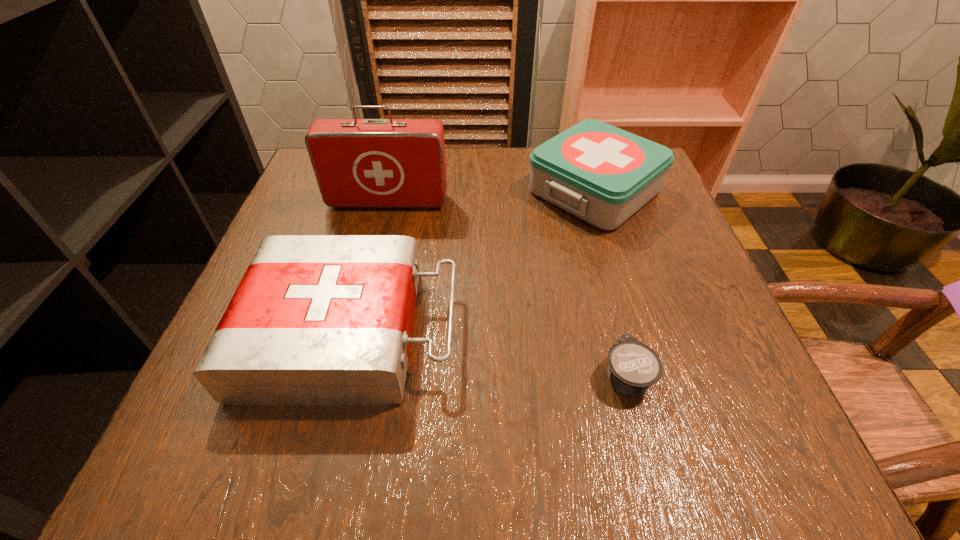
Identify the location of free space between the rightmost first-aid kit and the tallest first-aid kit. Image resolution: width=960 pixels, height=540 pixels. (492, 197).

What are the coordinates of `empty location between the shortest object and the nearest first-aid kit` in the screenshot? It's located at (489, 353).

You are a GUI agent. You are given a task and a screenshot of the screen. Output one action in this format:
    pyautogui.click(x=<x>, y=<y>)
    Task: Click on the free space between the nearest first-aid kit and the rightmost first-aid kit
    Image resolution: width=960 pixels, height=540 pixels.
    Given the screenshot: What is the action you would take?
    pyautogui.click(x=473, y=261)

Identify the location of object that is the closest to the rightmost first-aid kit. (359, 163).

Locate an element on the screen. The image size is (960, 540). object that ranks as the second closest to the yogurt is located at coordinates (602, 174).

Identify which first-aid kit is located as the second nearest to the tallest object. Please provide its 2D coordinates. Your answer should be formatted as a tuple, i.e. [(x, y)], where the tuple contains the x and y coordinates of a point satisfying the conditions above.

[(317, 319)]

At what (x,y) coordinates should I click in order to perform the action: click on the first-aid kit that is the second closest to the shortest object. Please return your answer as a coordinate pair (x, y). Looking at the image, I should click on (602, 174).

Locate an element on the screen. Image resolution: width=960 pixels, height=540 pixels. blank space that satisfies the following two spatial constraints: 1. on the side of the tallest first-aid kit with the first aid cross symbol; 2. on the front side of the nearest first-aid kit is located at coordinates (357, 331).

Image resolution: width=960 pixels, height=540 pixels. In order to click on vacant area in the image that satisfies the following two spatial constraints: 1. on the side of the tallest object with the first aid cross symbol; 2. on the left side of the yogurt in this screenshot , I will do `click(347, 375)`.

I want to click on free space that satisfies the following two spatial constraints: 1. on the side of the tallest first-aid kit with the first aid cross symbol; 2. on the front side of the nearest first-aid kit, so click(357, 331).